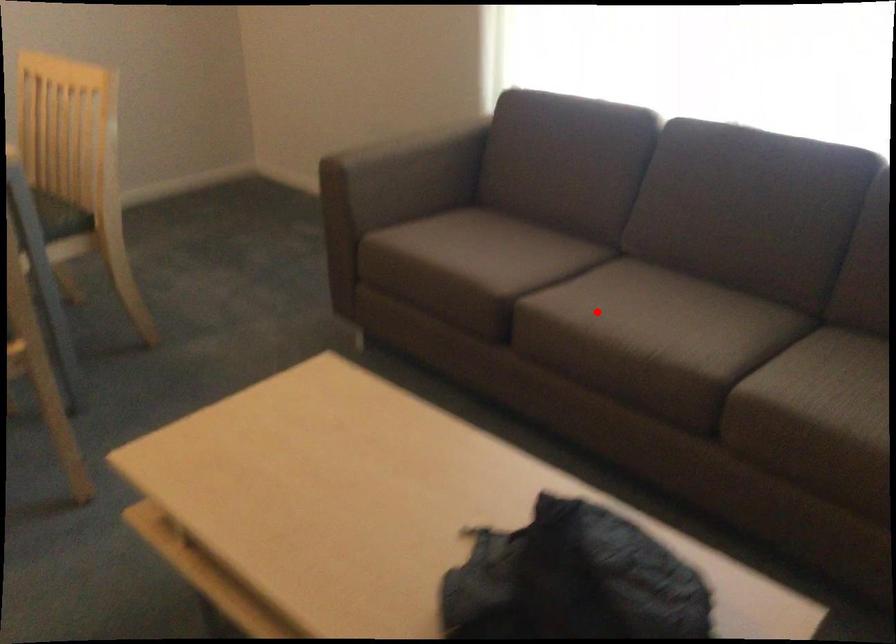
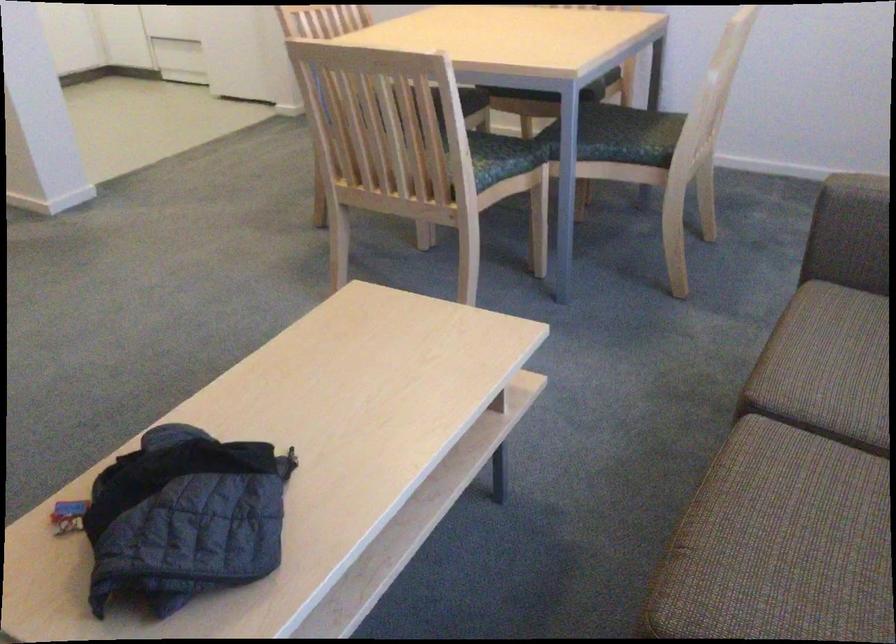
Question: I am providing you with two images of the same scene from different viewpoints. Given a red point in image1, look at the same physical point in image2. Is it:

Choices:
 (A) Closer to the viewpoint
 (B) Farther from the viewpoint

Answer: (A)